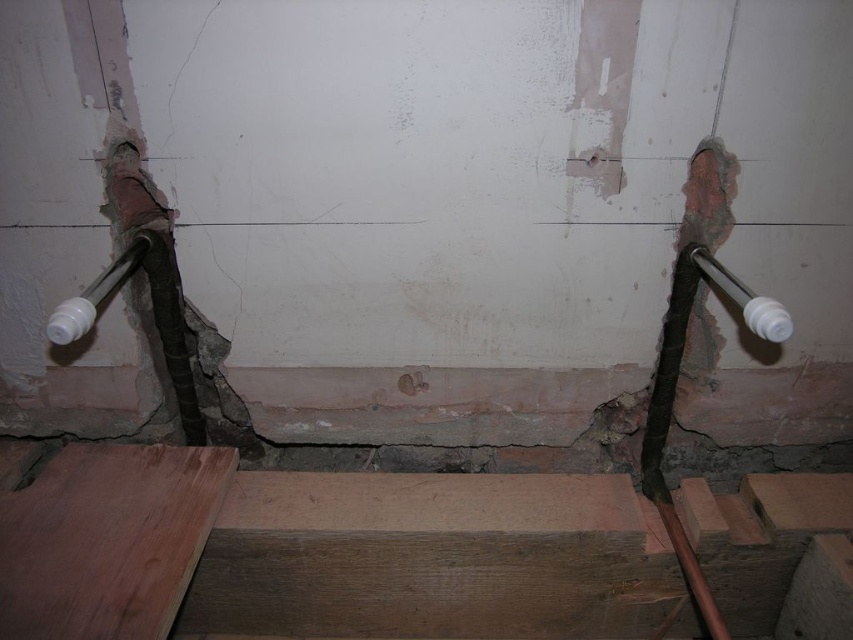
Between white plastic pipe at left and white plastic pipe at right, which one is positioned lower?

Positioned lower is white plastic pipe at left.

How far apart are white plastic pipe at left and white plastic pipe at right?

1.62 meters

Does point (62, 342) come closer to viewer compared to point (689, 252)?

Yes, point (62, 342) is in front of point (689, 252).

Locate an element on the screen. The width and height of the screenshot is (853, 640). white plastic pipe at left is located at coordinates (94, 294).